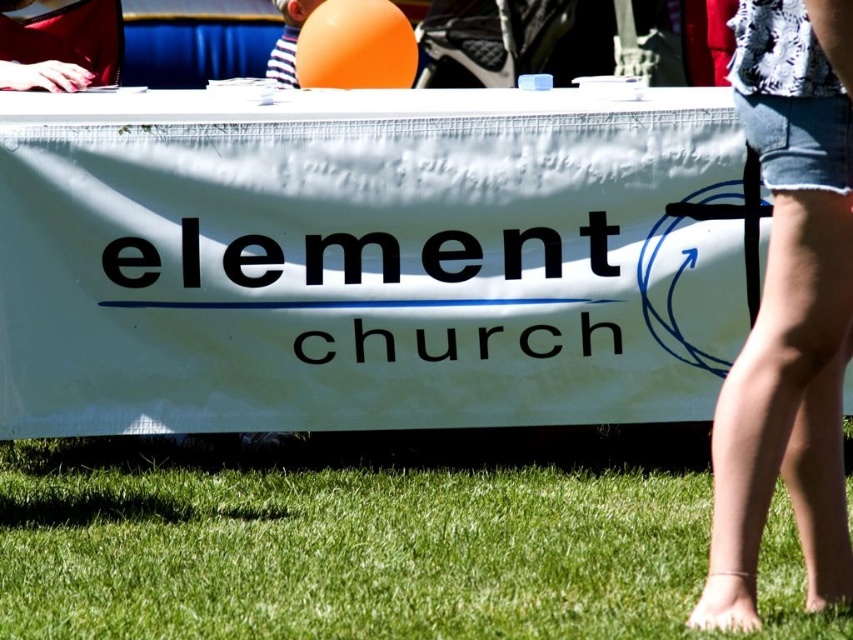
You are a photographer setting up a shot of the banner on the table. You notice the green grass at lower center and denim shorts at lower right. Which object is closer to the camera based on their positions?

The denim shorts at lower right are closer to the camera because they are positioned over the green grass at lower center, indicating they are in a lower layer in the image.

You are standing on the green grass at lower center. Looking at the image, what is the 2D coordinate of your current position?

The 2D coordinate of the green grass at lower center is at point [357,534].

You are a photographer setting up a tripod. You need to place it between the green grass at lower center and the denim shorts at lower right. The tripod requires at least 1 meter of space. Is there enough space?

The distance between the green grass at lower center and the denim shorts at lower right is 1.11 meters, which is more than the required 1 meter. Therefore, there is enough space to place the tripod.